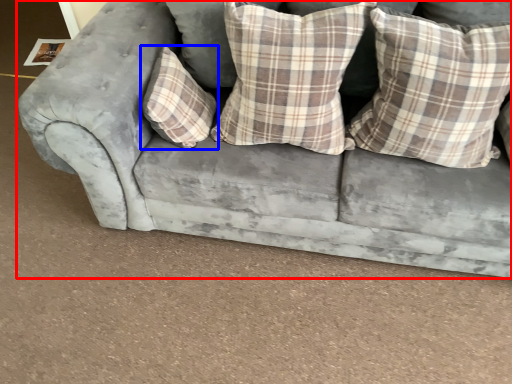
Question: Which point is closer to the camera, studio couch (highlighted by a red box) or pillow (highlighted by a blue box)?

Choices:
 (A) studio couch
 (B) pillow

Answer: (A)